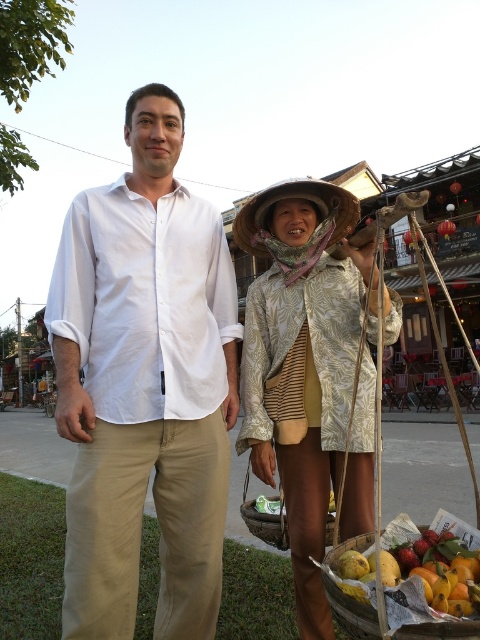
Question: Which point appears farthest from the camera in this image?

Choices:
 (A) (454, 584)
 (B) (338, 236)
 (C) (216, 602)
 (D) (319, 484)

Answer: (B)

Question: Which point is farther from the camera taking this photo?

Choices:
 (A) (349, 212)
 (B) (282, 248)

Answer: (A)

Question: Can you confirm if shiny yellow mangoes at lower right is positioned to the left of natural straw hat at center?

Choices:
 (A) no
 (B) yes

Answer: (A)

Question: Which object appears closest to the camera in this image?

Choices:
 (A) shiny yellow mangoes at lower right
 (B) white linen shirt at center
 (C) natural straw hat at center

Answer: (A)

Question: Does white linen shirt at center have a smaller size compared to natural straw hat at center?

Choices:
 (A) no
 (B) yes

Answer: (A)

Question: Can you confirm if white linen shirt at center is positioned to the right of shiny yellow mangoes at lower right?

Choices:
 (A) no
 (B) yes

Answer: (A)